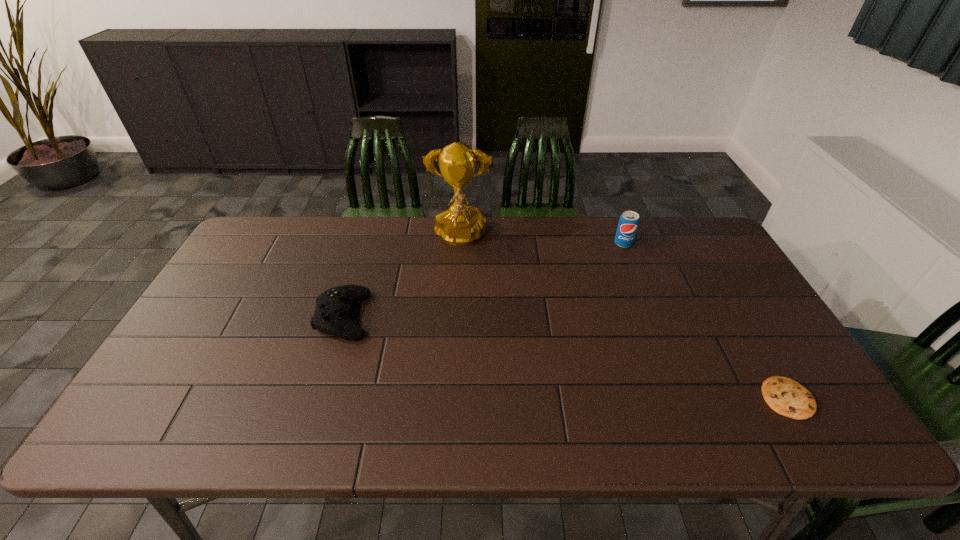
Locate an element on the screen. award is located at coordinates (459, 225).

At what (x,y) coordinates should I click in order to perform the action: click on the second object from left to right. Please return your answer as a coordinate pair (x, y). Looking at the image, I should click on (459, 225).

In order to click on soda can in this screenshot , I will do `click(628, 223)`.

Find the location of a particular element. The height and width of the screenshot is (540, 960). the third shortest object is located at coordinates (628, 223).

At what (x,y) coordinates should I click in order to perform the action: click on the third farthest object. Please return your answer as a coordinate pair (x, y). Looking at the image, I should click on (333, 312).

Find the location of a particular element. The image size is (960, 540). the leftmost object is located at coordinates (333, 312).

The image size is (960, 540). What are the coordinates of `the nearest object` in the screenshot? It's located at tap(787, 397).

At what (x,y) coordinates should I click in order to perform the action: click on the rightmost object. Please return your answer as a coordinate pair (x, y). This screenshot has height=540, width=960. Looking at the image, I should click on (787, 397).

Identify the location of vacant space located on the front side of the third object from right to left. (457, 284).

You are a GUI agent. You are given a task and a screenshot of the screen. Output one action in this format:
    pyautogui.click(x=<x>, y=<y>)
    Task: Click on the vacant space located on the left of the second tallest object
    
    Given the screenshot: What is the action you would take?
    pyautogui.click(x=599, y=244)